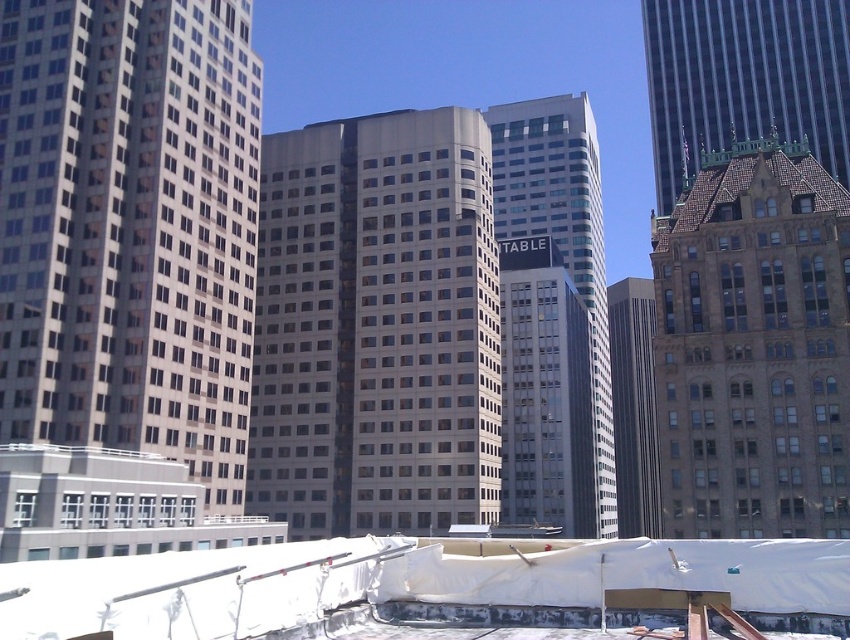
You are standing at the point marked by the coordinates point (377,326) in the cityscape. What type of building are you directly facing?

The point (377,326) marks the beige glass building at center, so you are directly facing the beige glass building at center.

You are standing on the sidewalk in front of the brown stone building at right and the gray glass skyscraper at center. Which building is closer to the ground level?

The brown stone building at right is closer to the ground level than the gray glass skyscraper at center because it is positioned below it.

You are a city planner reviewing this area. You need to determine which of the two buildings, the beige glass building at center or the gray glass skyscraper at center, is shorter. Based on the scene, which one is shorter?

The beige glass building at center is shorter than the gray glass skyscraper at center.